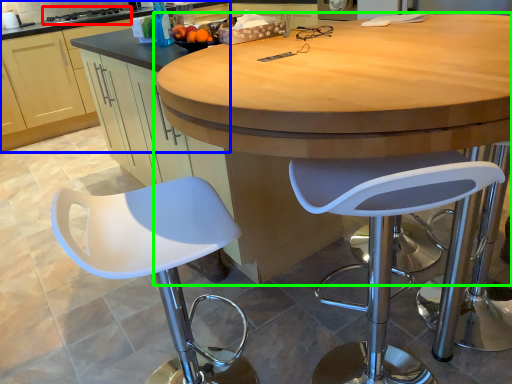
Question: Which object is the farthest from stove (highlighted by a red box)? Choose among these: cabinetry (highlighted by a blue box) or table (highlighted by a green box).

Choices:
 (A) cabinetry
 (B) table

Answer: (B)